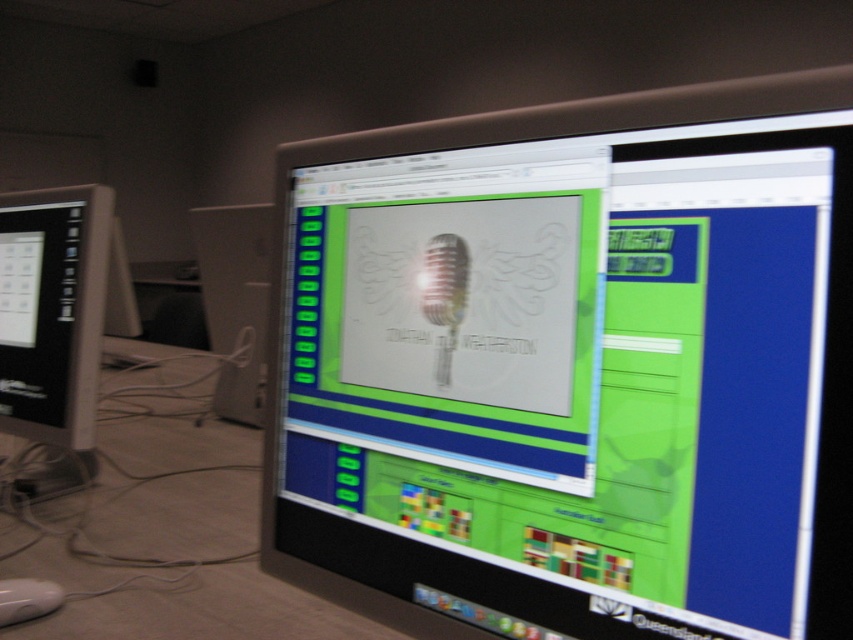
Question: From the image, what is the correct spatial relationship of matte black monitor at center in relation to matte black monitor at left?

Choices:
 (A) right
 (B) left

Answer: (A)

Question: Which point appears closest to the camera in this image?

Choices:
 (A) (88, 296)
 (B) (820, 163)

Answer: (B)

Question: Which of these objects is positioned closest to the matte black monitor at left?

Choices:
 (A) matte black monitor at center
 (B) white plastic computer tower at center-left
 (C) white plastic mouse at lower left

Answer: (C)

Question: Which is nearer to the white plastic mouse at lower left?

Choices:
 (A) white plastic computer tower at center-left
 (B) matte black monitor at left

Answer: (B)

Question: Does matte black monitor at center have a smaller size compared to white plastic computer tower at center-left?

Choices:
 (A) yes
 (B) no

Answer: (B)

Question: Considering the relative positions of matte black monitor at center and white plastic computer tower at center-left in the image provided, where is matte black monitor at center located with respect to white plastic computer tower at center-left?

Choices:
 (A) above
 (B) below

Answer: (B)